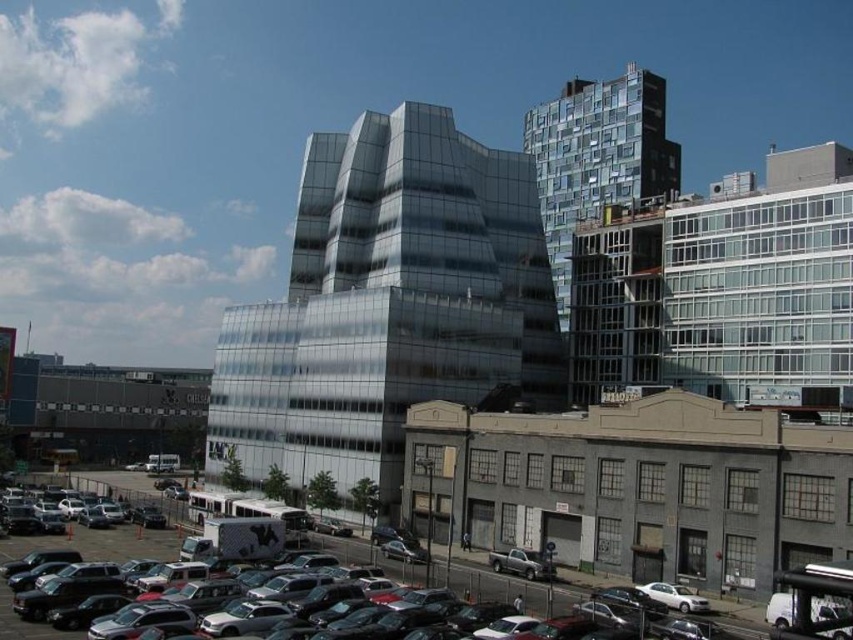
Question: Which object appears closest to the camera in this image?

Choices:
 (A) dark gray asphalt parking lot at lower left
 (B) silver metallic sedan at center
 (C) shiny black sedan at lower left
 (D) gray concrete building at lower center

Answer: (C)

Question: Is gray concrete building at lower center behind silver metallic sedan at center?

Choices:
 (A) no
 (B) yes

Answer: (A)

Question: Is dark gray asphalt parking lot at lower left closer to camera compared to shiny black sedan at lower left?

Choices:
 (A) yes
 (B) no

Answer: (B)

Question: Among these objects, which one is farthest from the camera?

Choices:
 (A) gray concrete building at lower center
 (B) silver metallic sedan at center
 (C) dark gray asphalt parking lot at lower left
 (D) shiny black sedan at lower left

Answer: (B)

Question: Which point is farther from the camera taking this photo?

Choices:
 (A) (91, 536)
 (B) (430, 458)
 (C) (722, 611)

Answer: (B)

Question: Can you confirm if shiny black sedan at lower left is thinner than silver metallic sedan at center?

Choices:
 (A) yes
 (B) no

Answer: (B)